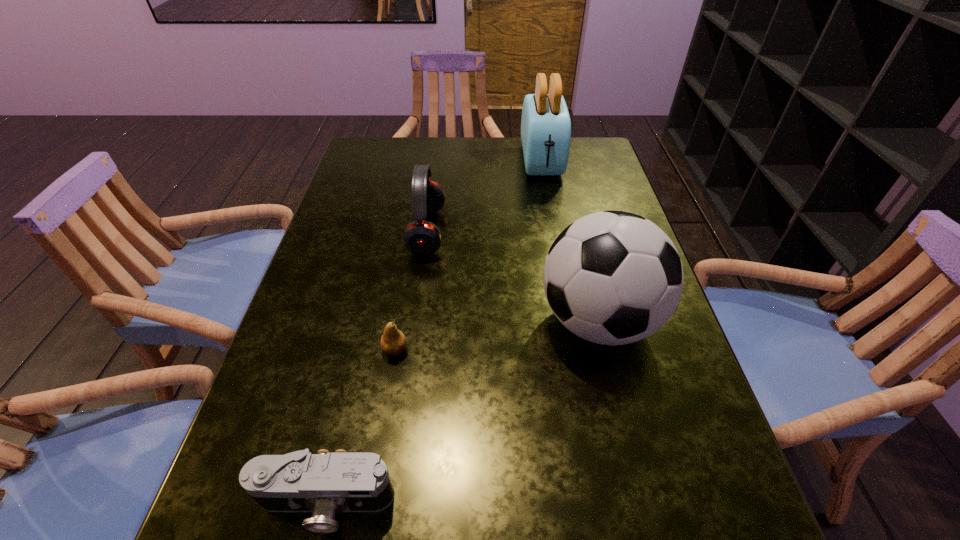
Select which object appears as the fourth closest to the nearest object. Please provide its 2D coordinates. Your answer should be formatted as a tuple, i.e. [(x, y)], where the tuple contains the x and y coordinates of a point satisfying the conditions above.

[(545, 125)]

The height and width of the screenshot is (540, 960). In order to click on vacant region that satisfies the following two spatial constraints: 1. on the side of the toaster with the lever; 2. on the ear cups of the third tallest object in this screenshot , I will do coord(555,231).

In order to click on vacant area that satisfies the following two spatial constraints: 1. on the ear cups of the second farthest object; 2. on the left side of the soccer ball in this screenshot , I will do `click(415, 321)`.